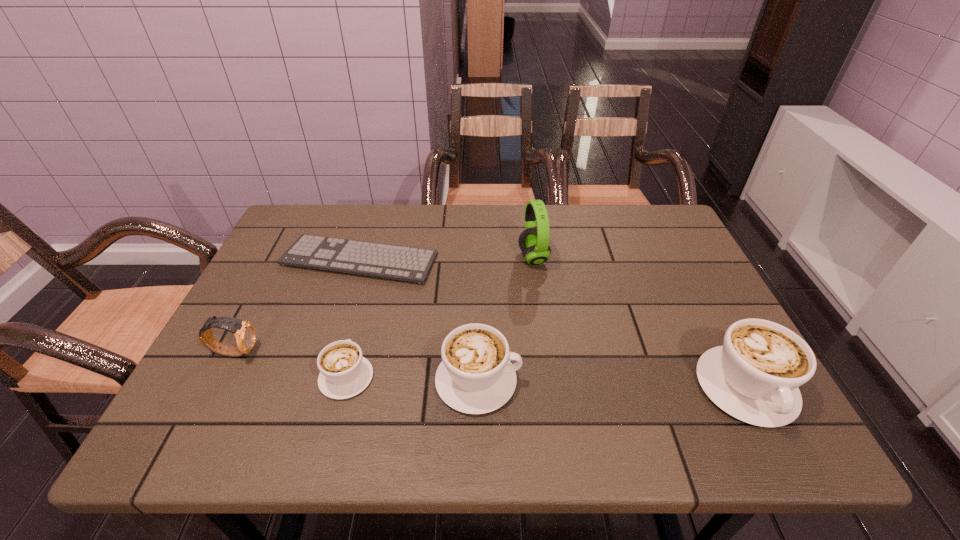
Please point a location where one more cappuccino can be added evenly. Please provide its 2D coordinates. Your answer should be formatted as a tuple, i.e. [(x, y)], where the tuple contains the x and y coordinates of a point satisfying the conditions above.

[(612, 384)]